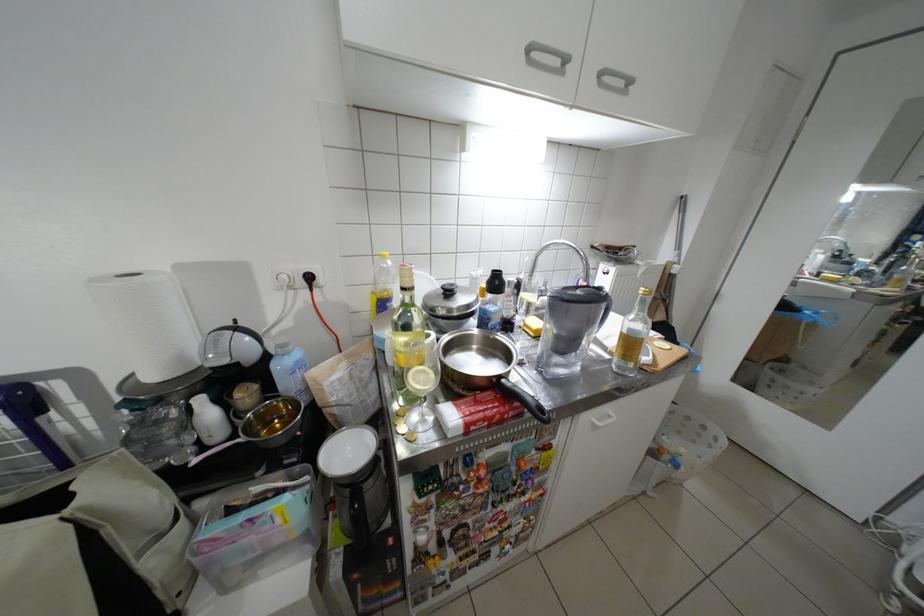
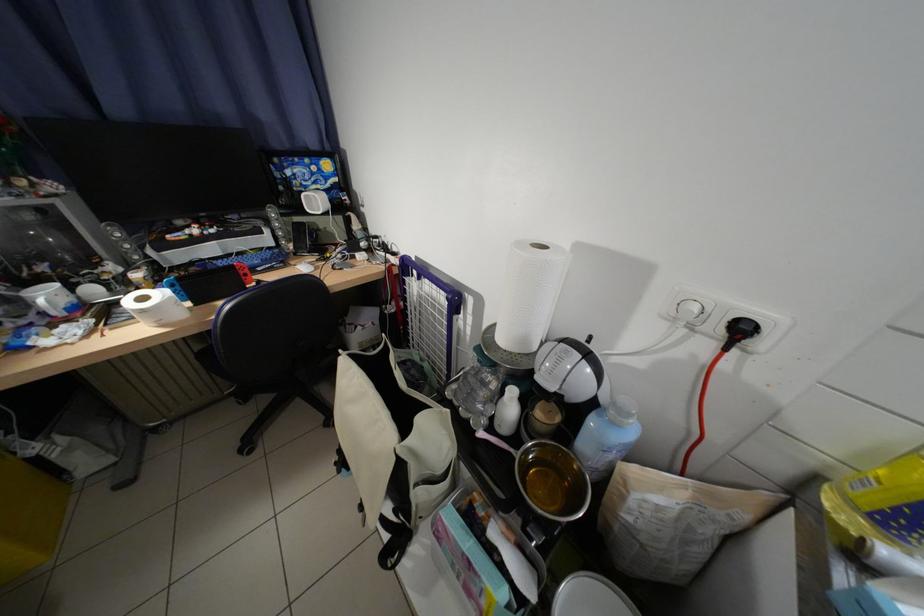
Find the pixel in the second image that matches (249,442) in the first image.

(524, 453)